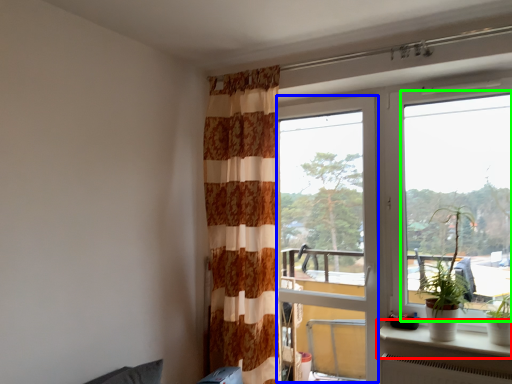
Question: Considering the real-world distances, which object is farthest from window sill (highlighted by a red box)? screen door (highlighted by a blue box) or window (highlighted by a green box)?

Choices:
 (A) screen door
 (B) window

Answer: (B)